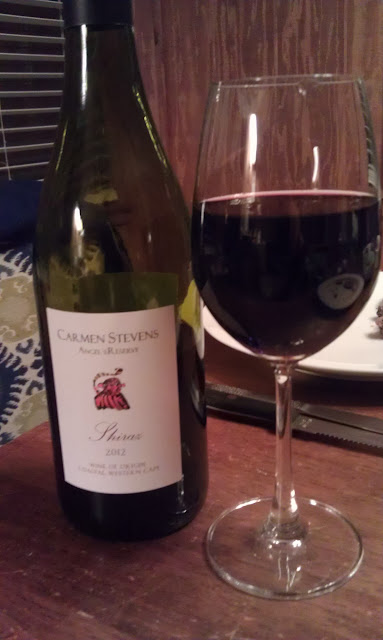
The image size is (383, 640). Find the location of `table`. table is located at coordinates (144, 598).